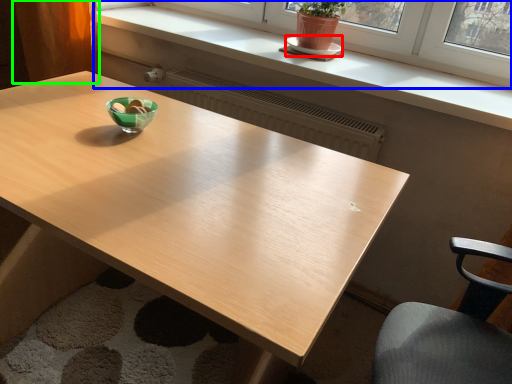
Question: Based on their relative distances, which object is farther from saucer (highlighted by a red box)? Choose from window (highlighted by a blue box) and curtain (highlighted by a green box).

Choices:
 (A) window
 (B) curtain

Answer: (B)